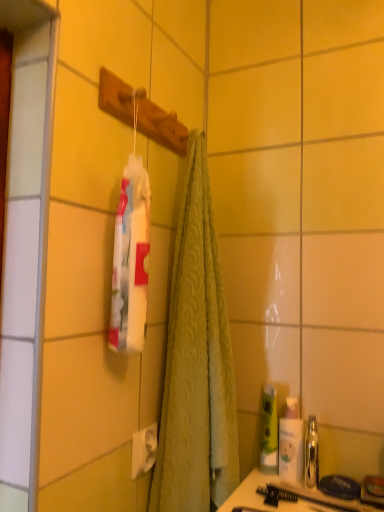
Question: Would you say green matte bottle at lower right, arranged as the second mouthwash when viewed from the right, contains matte black comb at lower center?

Choices:
 (A) yes
 (B) no

Answer: (B)

Question: From a real-world perspective, does green matte bottle at lower right, arranged as the second mouthwash when viewed from the right, sit lower than matte black comb at lower center?

Choices:
 (A) yes
 (B) no

Answer: (B)

Question: From the image's perspective, is green matte bottle at lower right, arranged as the second mouthwash when viewed from the right, on matte black comb at lower center?

Choices:
 (A) yes
 (B) no

Answer: (A)

Question: Is green matte bottle at lower right, arranged as the second mouthwash when viewed from the right, shorter than matte black comb at lower center?

Choices:
 (A) no
 (B) yes

Answer: (A)

Question: Is green matte bottle at lower right, arranged as the second mouthwash when viewed from the right, not near matte black comb at lower center?

Choices:
 (A) no
 (B) yes

Answer: (A)

Question: Is green matte bottle at lower right, arranged as the second mouthwash when viewed from the right, to the right of matte black comb at lower center from the viewer's perspective?

Choices:
 (A) no
 (B) yes

Answer: (A)

Question: Does matte black comb at lower center turn towards shiny metallic mouthwash at right, acting as the first mouthwash starting from the right?

Choices:
 (A) yes
 (B) no

Answer: (A)

Question: Considering the relative positions of matte black comb at lower center and shiny metallic mouthwash at right, acting as the first mouthwash starting from the right, in the image provided, is matte black comb at lower center to the left of shiny metallic mouthwash at right, acting as the first mouthwash starting from the right, from the viewer's perspective?

Choices:
 (A) no
 (B) yes

Answer: (B)

Question: Can you confirm if matte black comb at lower center is smaller than shiny metallic mouthwash at right, acting as the first mouthwash starting from the right?

Choices:
 (A) no
 (B) yes

Answer: (B)

Question: Does matte black comb at lower center appear on the right side of shiny metallic mouthwash at right, the 2th mouthwash in the left-to-right sequence?

Choices:
 (A) no
 (B) yes

Answer: (A)

Question: Can you confirm if matte black comb at lower center is thinner than shiny metallic mouthwash at right, acting as the first mouthwash starting from the right?

Choices:
 (A) yes
 (B) no

Answer: (A)

Question: From a real-world perspective, is matte black comb at lower center over shiny metallic mouthwash at right, the 2th mouthwash in the left-to-right sequence?

Choices:
 (A) yes
 (B) no

Answer: (B)

Question: From the image's perspective, is translucent plastic bottle at right over green matte bottle at lower right, arranged as the second mouthwash when viewed from the right?

Choices:
 (A) no
 (B) yes

Answer: (A)